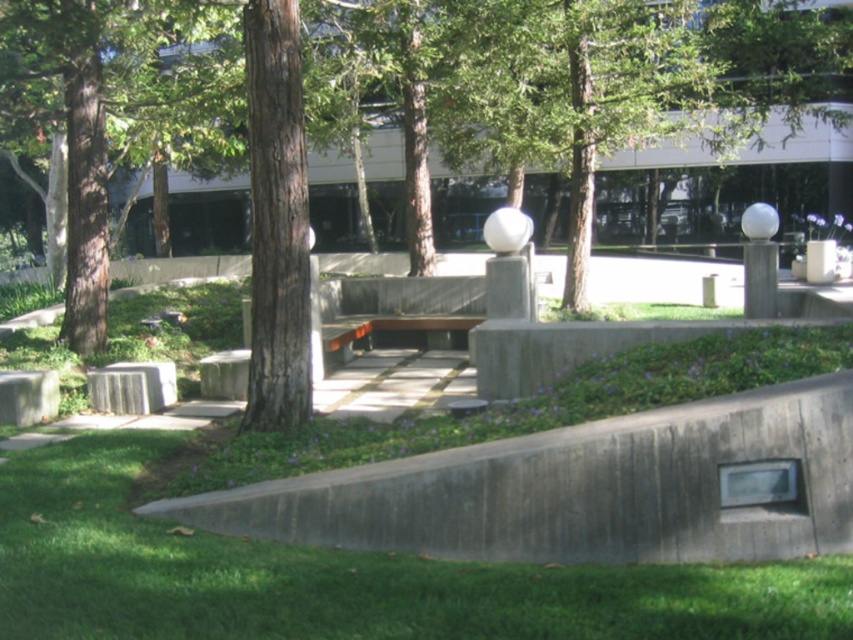
Question: In this image, where is concrete bench at center located relative to wooden bench at center?

Choices:
 (A) right
 (B) left

Answer: (A)

Question: Among these objects, which one is nearest to the camera?

Choices:
 (A) brown rough bark tree at center
 (B) green grass at lower left

Answer: (B)

Question: Among these points, which one is nearest to the camera?

Choices:
 (A) (341, 346)
 (B) (402, 321)
 (C) (302, 253)
 (D) (637, 627)

Answer: (D)

Question: Which point appears closest to the camera in this image?

Choices:
 (A) (263, 32)
 (B) (263, 496)

Answer: (B)

Question: Can you confirm if brown rough bark tree at center is wider than wooden bench at center?

Choices:
 (A) yes
 (B) no

Answer: (B)

Question: Where is brown rough bark tree at center located in relation to wooden bench at center in the image?

Choices:
 (A) left
 (B) right

Answer: (A)